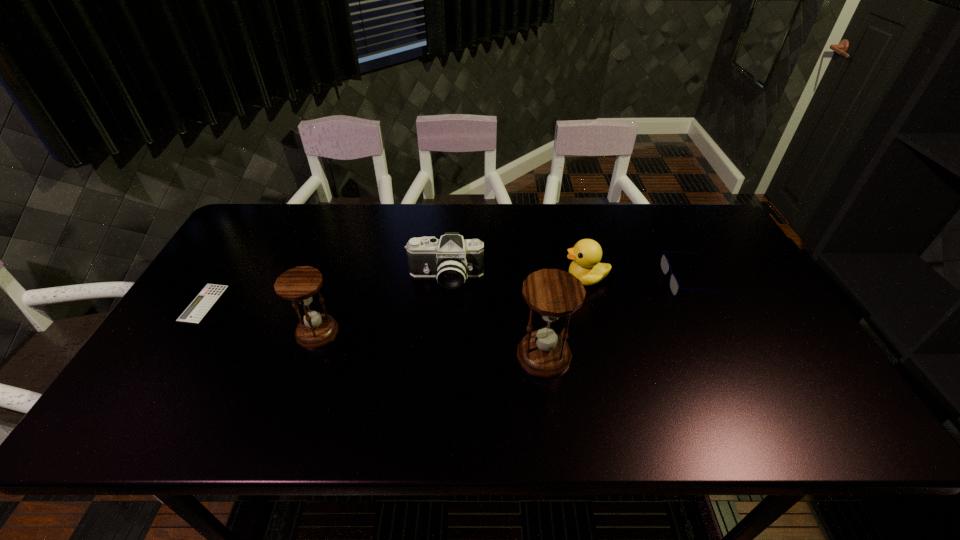
Where is `the left hourglass`? Image resolution: width=960 pixels, height=540 pixels. the left hourglass is located at coordinates (299, 285).

Locate an element on the screen. the shorter hourglass is located at coordinates (299, 285).

Locate an element on the screen. Image resolution: width=960 pixels, height=540 pixels. the taller hourglass is located at coordinates (552, 293).

The image size is (960, 540). Find the location of `the tallest object`. the tallest object is located at coordinates (552, 293).

Locate an element on the screen. This screenshot has width=960, height=540. the shortest object is located at coordinates (199, 307).

This screenshot has width=960, height=540. Identify the location of calculator. (199, 307).

Where is `the second shortest object`? The height and width of the screenshot is (540, 960). the second shortest object is located at coordinates (674, 285).

Identify the location of the rightmost object. (674, 285).

Locate an element on the screen. The height and width of the screenshot is (540, 960). camera is located at coordinates (451, 259).

The height and width of the screenshot is (540, 960). I want to click on duck, so click(x=587, y=253).